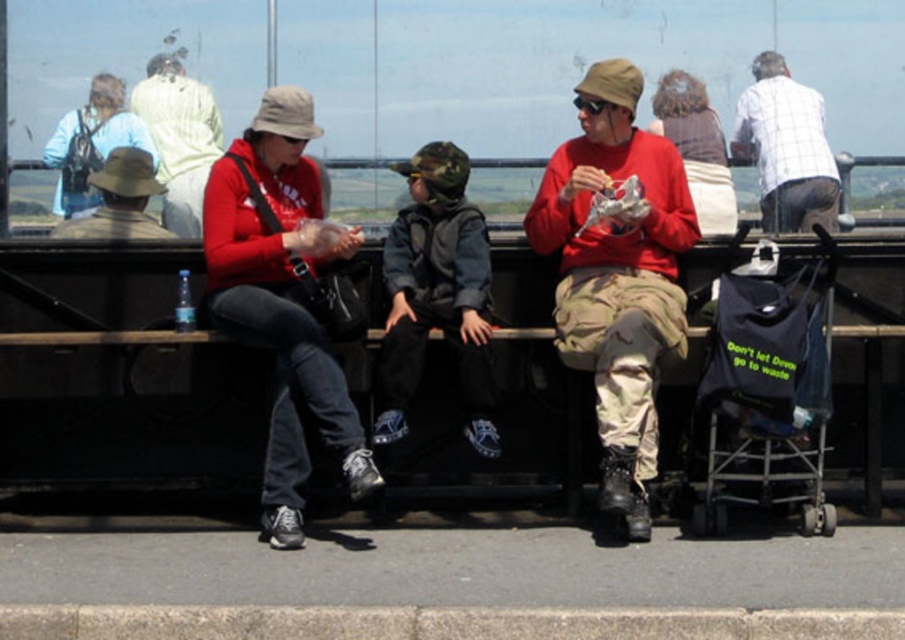
What do you see at coordinates (765, 397) in the screenshot?
I see `dark blue fabric stroller at right` at bounding box center [765, 397].

Does dark blue fabric stroller at right appear under matte khaki hat at upper left?

Correct, dark blue fabric stroller at right is located below matte khaki hat at upper left.

Who is more distant from viewer, [796,355] or [63,189]?

Point [63,189]

Locate an element on the screen. The image size is (905, 640). dark blue fabric stroller at right is located at coordinates (765, 397).

Who is taller, dark blue fabric stroller at right or camo fabric jacket at center?

camo fabric jacket at center is taller.

Does point (796, 412) come farther from viewer compared to point (395, 253)?

That is False.

Find the location of `dark blue fabric stroller at right`. dark blue fabric stroller at right is located at coordinates (765, 397).

I want to click on camo fabric jacket at center, so click(x=437, y=294).

Which is more to the right, camo fabric jacket at center or white checkered shirt at upper right?

white checkered shirt at upper right

What do you see at coordinates (437, 294) in the screenshot? I see `camo fabric jacket at center` at bounding box center [437, 294].

Find the location of `camo fabric jacket at center`. camo fabric jacket at center is located at coordinates (437, 294).